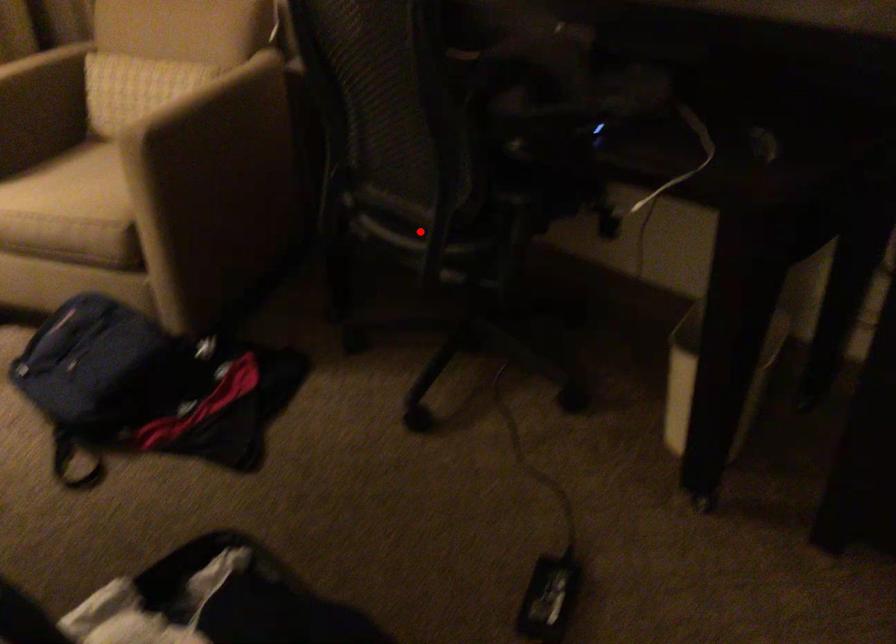
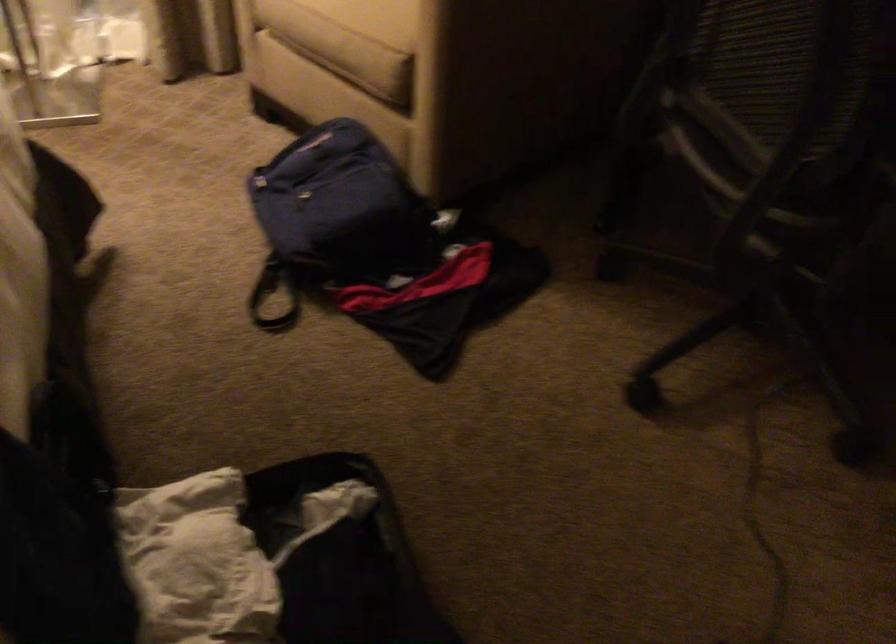
Find the pixel in the second image that matches the highlighted location in the first image.

(736, 167)